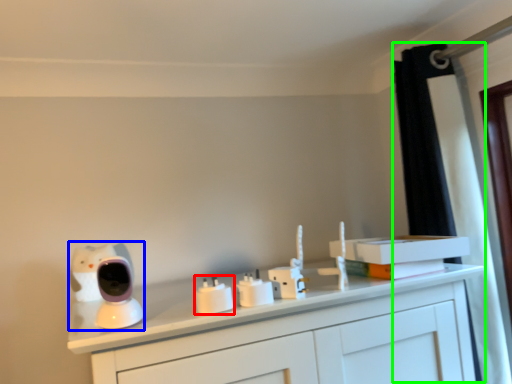
Question: Which object is the farthest from electric outlet (highlighted by a red box)? Choose among these: toy (highlighted by a blue box) or curtain (highlighted by a green box).

Choices:
 (A) toy
 (B) curtain

Answer: (B)